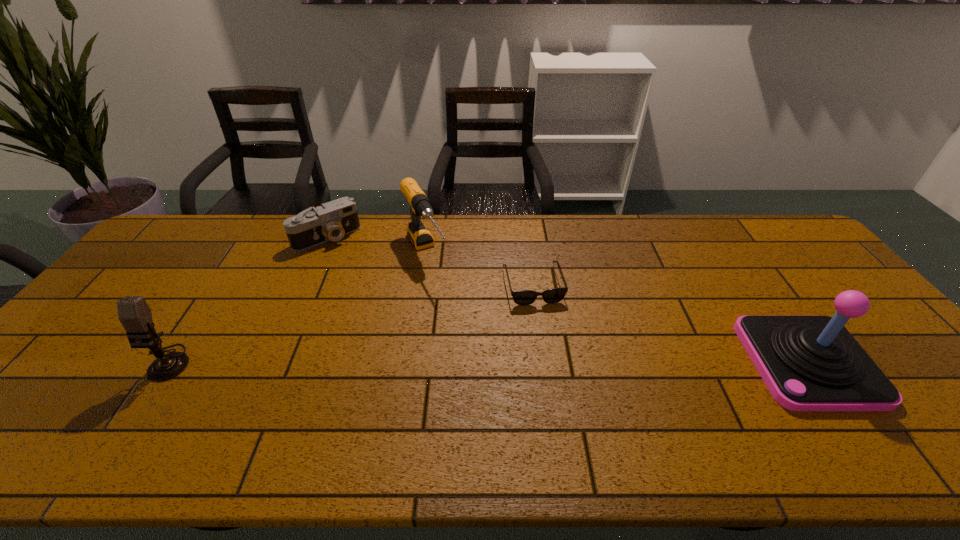
At what (x,y) coordinates should I click in order to perform the action: click on camera that is positioned at the far edge. Please return your answer as a coordinate pair (x, y). Looking at the image, I should click on pos(333,220).

You are a GUI agent. You are given a task and a screenshot of the screen. Output one action in this format:
    pyautogui.click(x=<x>, y=<y>)
    Task: Click on the object situated at the near edge
    The image size is (960, 540).
    Given the screenshot: What is the action you would take?
    pyautogui.click(x=809, y=363)

Identify the location of object positioned at the right edge. This screenshot has height=540, width=960. (809, 363).

Where is `object present at the near right corner`? The width and height of the screenshot is (960, 540). object present at the near right corner is located at coordinates (809, 363).

I want to click on vacant space at the far edge of the desktop, so click(x=594, y=252).

Identify the location of free space at the near edge. The image size is (960, 540). (621, 397).

Image resolution: width=960 pixels, height=540 pixels. Find the location of `free space at the left edge of the desktop`. free space at the left edge of the desktop is located at coordinates (113, 291).

Identify the location of free region at the right edge of the desktop. The height and width of the screenshot is (540, 960). (804, 297).

Where is `vacant space at the far left corner`? The width and height of the screenshot is (960, 540). vacant space at the far left corner is located at coordinates (185, 249).

This screenshot has width=960, height=540. In the image, there is a desktop. Find the location of `free space at the far right corner`. free space at the far right corner is located at coordinates (780, 253).